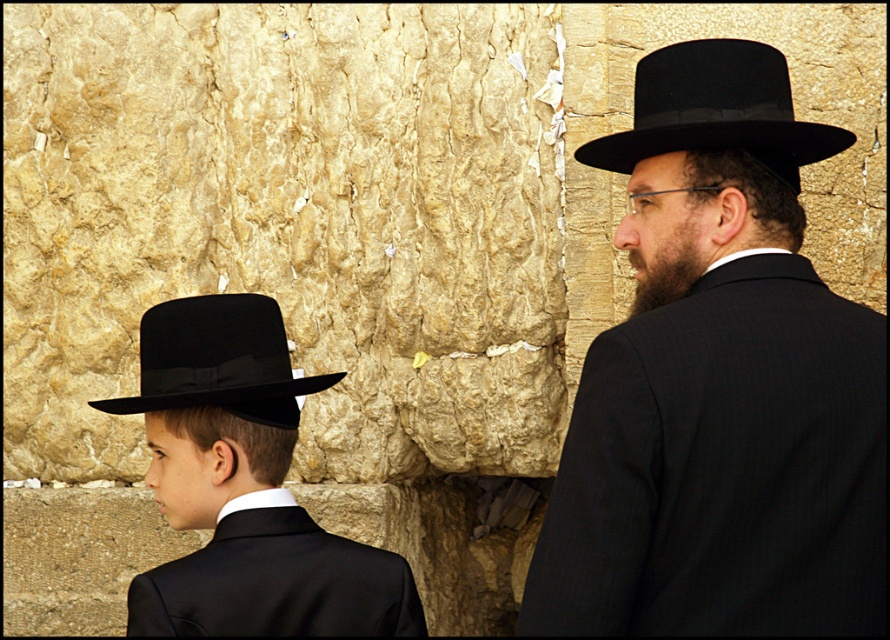
Question: Which of these objects is positioned farthest from the black matte suit at lower left?

Choices:
 (A) matte black hat at right
 (B) matte black hat at left
 (C) black felt hat at left
 (D) black felt fedora at upper right

Answer: (A)

Question: Which object is closer to the camera taking this photo?

Choices:
 (A) black felt hat at left
 (B) matte black hat at right

Answer: (B)

Question: Does matte black hat at right have a lesser width compared to black matte suit at lower left?

Choices:
 (A) yes
 (B) no

Answer: (A)

Question: Is matte black hat at left smaller than black felt fedora at upper right?

Choices:
 (A) no
 (B) yes

Answer: (B)

Question: Which of the following is the farthest from the observer?

Choices:
 (A) (761, 202)
 (B) (290, 522)

Answer: (B)

Question: Is matte black hat at right bigger than black felt fedora at upper right?

Choices:
 (A) no
 (B) yes

Answer: (A)